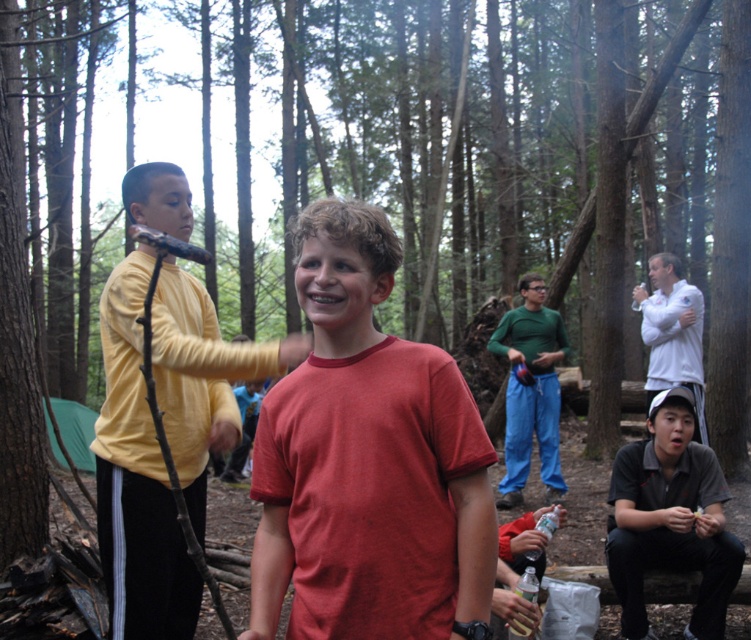
Does yellow fleece jacket at left have a greater width compared to green fabric pants at center?

Yes, yellow fleece jacket at left is wider than green fabric pants at center.

Does yellow fleece jacket at left have a lesser width compared to green fabric pants at center?

In fact, yellow fleece jacket at left might be wider than green fabric pants at center.

Which is behind, point (125, 493) or point (549, 352)?

Point (549, 352)

Where is `yellow fleece jacket at left`? yellow fleece jacket at left is located at coordinates (136, 480).

Does dark gray polo shirt at lower right lie behind white matte shirt at right?

No.

Between dark gray polo shirt at lower right and white matte shirt at right, which one is positioned lower?

Positioned lower is dark gray polo shirt at lower right.

The width and height of the screenshot is (751, 640). What do you see at coordinates (670, 518) in the screenshot?
I see `dark gray polo shirt at lower right` at bounding box center [670, 518].

Locate an element on the screen. This screenshot has height=640, width=751. dark gray polo shirt at lower right is located at coordinates (670, 518).

From the picture: Is yellow fleece jacket at left below dark gray polo shirt at lower right?

No.

Who is more distant from viewer, (185, 186) or (620, 614)?

The point (620, 614) is behind.

Describe the element at coordinates (136, 480) in the screenshot. This screenshot has height=640, width=751. I see `yellow fleece jacket at left` at that location.

This screenshot has height=640, width=751. In order to click on yellow fleece jacket at left in this screenshot , I will do `click(136, 480)`.